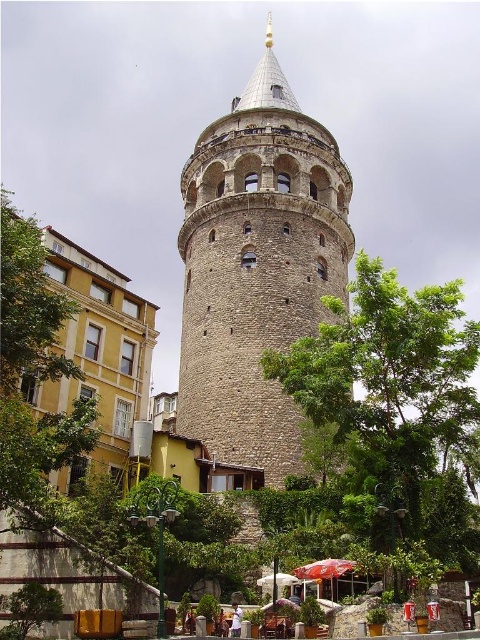
Question: Does brown stone tower at center appear over green leafy tree at lower left?

Choices:
 (A) no
 (B) yes

Answer: (B)

Question: Can you confirm if green leafy tree at lower left is smaller than red fabric umbrella at lower center?

Choices:
 (A) no
 (B) yes

Answer: (A)

Question: Which of the following is the farthest from the observer?

Choices:
 (A) (10, 208)
 (B) (305, 566)

Answer: (A)

Question: Is brown stone tower at center smaller than green leafy tree at center?

Choices:
 (A) yes
 (B) no

Answer: (B)

Question: Which point is closer to the camera taking this photo?

Choices:
 (A) (217, 284)
 (B) (298, 577)
 (C) (342, 410)

Answer: (B)

Question: Which object appears closest to the camera in this image?

Choices:
 (A) green leafy tree at center
 (B) brown stone tower at center
 (C) green leafy tree at lower left
 (D) red fabric umbrella at lower center

Answer: (A)